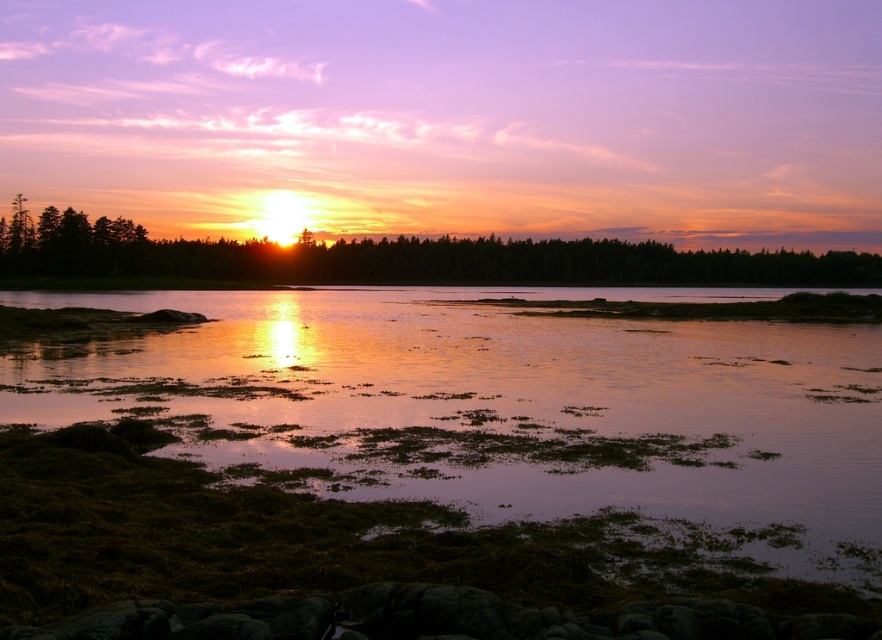
Between green algae at lower center and green leafy trees at center, which one has less height?

green algae at lower center is shorter.

Does point (437, 320) come in front of point (662, 268)?

Yes, it is.

At what (x,y) coordinates should I click in order to perform the action: click on green algae at lower center. Please return your answer as a coordinate pair (x, y). The width and height of the screenshot is (882, 640). Looking at the image, I should click on (501, 410).